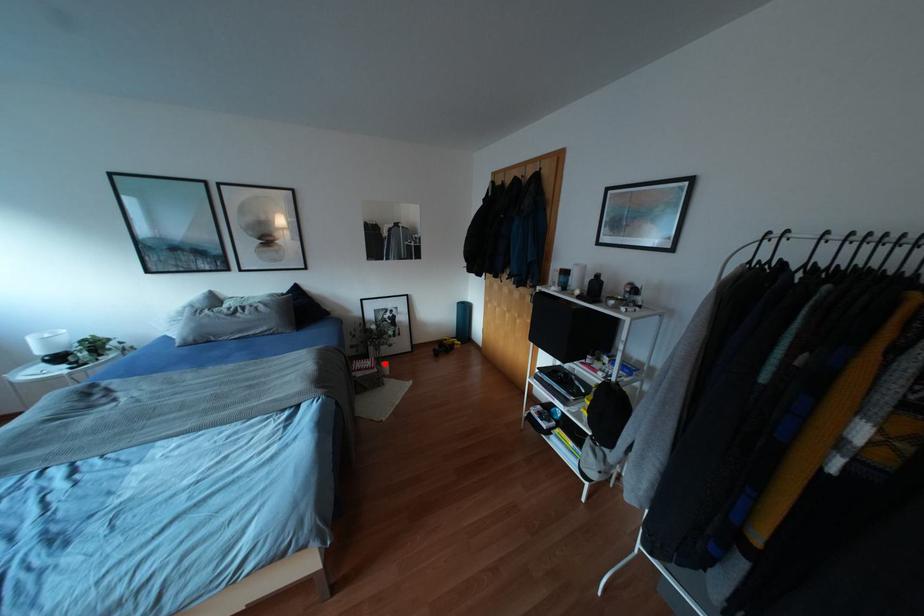
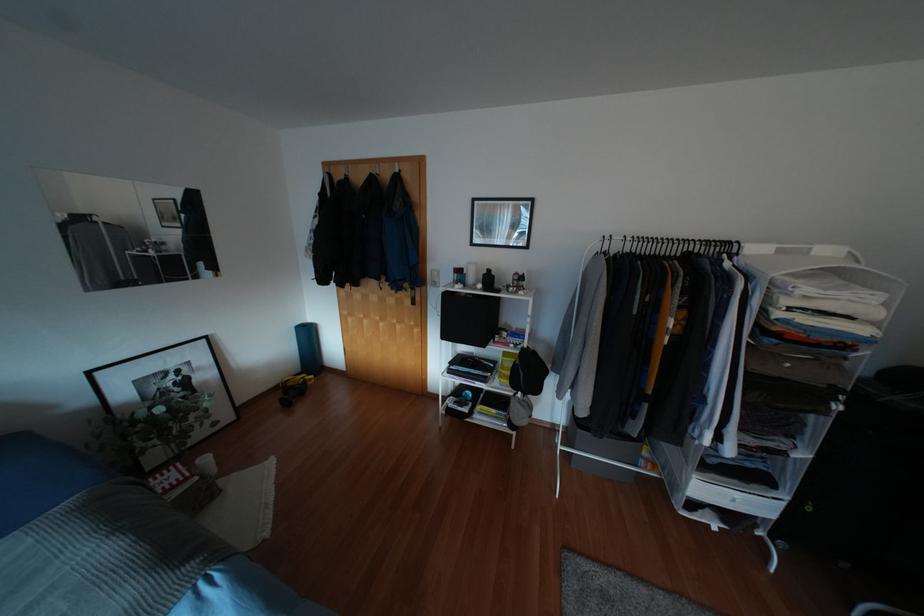
Locate, in the second image, the point that corresponds to the highlighted location in the first image.

(205, 459)